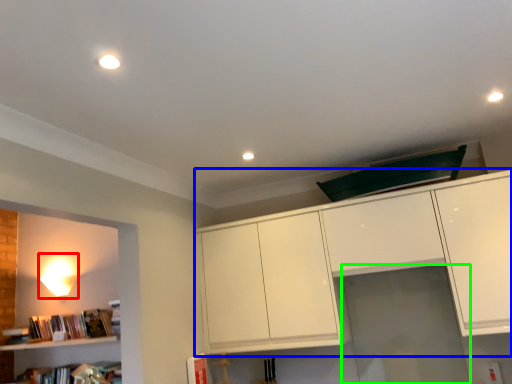
Question: Which object is positioned farthest from lamp (highlighted by a red box)? Select from cabinetry (highlighted by a blue box) and glass door (highlighted by a green box).

Choices:
 (A) cabinetry
 (B) glass door

Answer: (B)